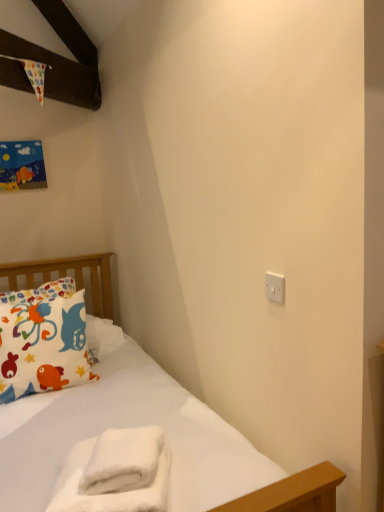
What is the approximate height of printed fabric pillow at left?

The height of printed fabric pillow at left is 21.24 inches.

The image size is (384, 512). What are the coordinates of `white plastic switch at upper right` in the screenshot? It's located at (275, 287).

Locate an element on the screen. Image resolution: width=384 pixels, height=512 pixels. white fluffy towel at lower center is located at coordinates (115, 473).

How different are the orientations of white fluffy towel at lower center and printed fabric pillow at left in degrees?

They differ by 16.8 degrees in their facing directions.

Is white fluffy towel at lower center situated inside printed fabric pillow at left or outside?

white fluffy towel at lower center is located beyond the bounds of printed fabric pillow at left.

You are a GUI agent. You are given a task and a screenshot of the screen. Output one action in this format:
    pyautogui.click(x=<x>, y=<y>)
    Task: Click on the material lying on the right of printed fabric pillow at left
    This screenshot has height=512, width=384.
    Given the screenshot: What is the action you would take?
    [115, 473]

Can you confirm if white fluffy towel at lower center is taller than printed fabric pillow at left?

In fact, white fluffy towel at lower center may be shorter than printed fabric pillow at left.

You are a GUI agent. You are given a task and a screenshot of the screen. Output one action in this format:
    pyautogui.click(x=<x>, y=<y>)
    Task: Click on the pillow lying behind the white fluffy towel at lower center
    
    Given the screenshot: What is the action you would take?
    (43, 340)

From the image's perspective, is printed fabric pillow at left located beneath white fluffy towel at lower center?

No.

Is point (4, 347) behind point (141, 460)?

Yes, point (4, 347) is farther from viewer.

Is printed fabric pillow at left far away from white fluffy towel at lower center?

Actually, printed fabric pillow at left and white fluffy towel at lower center are a little close together.

From the picture: Considering the sizes of objects white fluffy towel at lower center and white plastic switch at upper right in the image provided, who is bigger, white fluffy towel at lower center or white plastic switch at upper right?

With larger size is white fluffy towel at lower center.

Is white plastic switch at upper right located within white fluffy towel at lower center?

Actually, white plastic switch at upper right is outside white fluffy towel at lower center.

Looking at this image, does white fluffy towel at lower center appear on the left side of white plastic switch at upper right?

Yes.

Consider the image. From the image's perspective, relative to white fluffy towel at lower center, is white plastic switch at upper right above or below?

white plastic switch at upper right is above white fluffy towel at lower center.

Between white plastic switch at upper right and white fluffy towel at lower center, which one has smaller size?

With smaller size is white plastic switch at upper right.

From a real-world perspective, which object rests below the other?

white fluffy towel at lower center is physically lower.

From a real-world perspective, is printed fabric pillow at left under white plastic switch at upper right?

Yes.

Is printed fabric pillow at left further to the viewer compared to white plastic switch at upper right?

Yes, the depth of printed fabric pillow at left is greater than that of white plastic switch at upper right.

From the image's perspective, is printed fabric pillow at left above or below white plastic switch at upper right?

Based on their image positions, printed fabric pillow at left is located beneath white plastic switch at upper right.

Which point is more distant from viewer, (x=271, y=284) or (x=9, y=323)?

Positioned behind is point (x=9, y=323).

Is white plastic switch at upper right positioned with its back to printed fabric pillow at left?

No.

From the image's perspective, is white plastic switch at upper right located above or below printed fabric pillow at left?

white plastic switch at upper right is above printed fabric pillow at left.

Is white plastic switch at upper right far away from printed fabric pillow at left?

Yes, white plastic switch at upper right and printed fabric pillow at left are quite far apart.

This screenshot has width=384, height=512. Identify the location of pillow behind the white fluffy towel at lower center. (43, 340).

Where is `material on the right of printed fabric pillow at left`? material on the right of printed fabric pillow at left is located at coordinates (115, 473).

Which object lies nearer to the anchor point white plastic switch at upper right, white fluffy towel at lower center or printed fabric pillow at left?

white fluffy towel at lower center is closer to white plastic switch at upper right.

Based on their spatial positions, is white plastic switch at upper right or printed fabric pillow at left further from white fluffy towel at lower center?

printed fabric pillow at left is positioned further to the anchor white fluffy towel at lower center.

From the image, which object appears to be farther from white plastic switch at upper right, printed fabric pillow at left or white fluffy towel at lower center?

The object further to white plastic switch at upper right is printed fabric pillow at left.

Based on the photo, looking at the image, which one is located closer to printed fabric pillow at left, white plastic switch at upper right or white fluffy towel at lower center?

The object closer to printed fabric pillow at left is white fluffy towel at lower center.

From the image, which object appears to be farther from printed fabric pillow at left, white fluffy towel at lower center or white plastic switch at upper right?

white plastic switch at upper right is positioned further to the anchor printed fabric pillow at left.

Looking at the image, which one is located further to white fluffy towel at lower center, printed fabric pillow at left or white plastic switch at upper right?

printed fabric pillow at left.

Identify the location of material between printed fabric pillow at left and white plastic switch at upper right in the horizontal direction. (115, 473).